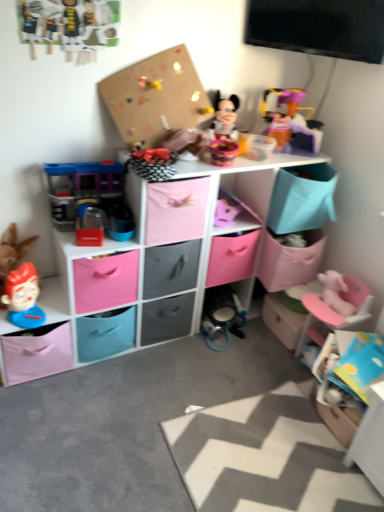
You are a GUI agent. You are given a task and a screenshot of the screen. Output one action in this format:
    pyautogui.click(x=<x>, y=<y>)
    Task: Click on the vacant space in front of pink fabric storage box at left, which ranks as the 3th storage box in right-to-left order
    Image resolution: width=384 pixels, height=512 pixels.
    Given the screenshot: What is the action you would take?
    pyautogui.click(x=36, y=416)